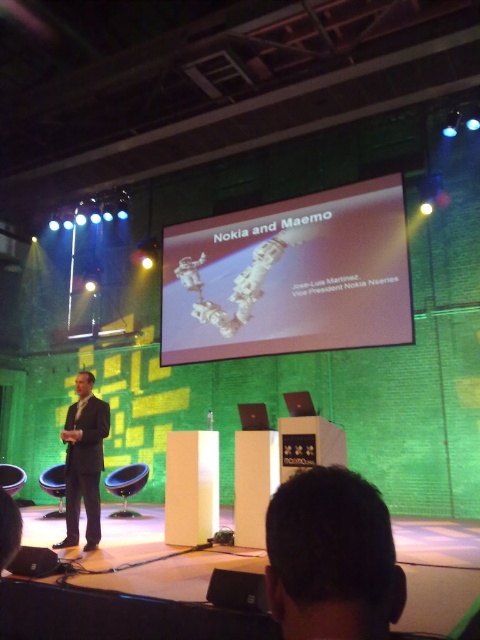
Question: Based on their relative distances, which object is nearer to the white glossy projector screen at upper center?

Choices:
 (A) dark suit at center
 (B) dark hair at upper center

Answer: (A)

Question: Is white glossy projector screen at upper center below dark hair at upper center?

Choices:
 (A) yes
 (B) no

Answer: (B)

Question: Which object is farther from the camera taking this photo?

Choices:
 (A) dark suit at center
 (B) white glossy projector screen at upper center

Answer: (B)

Question: Which point is farther from the camera taking this photo?

Choices:
 (A) (403, 579)
 (B) (272, 326)
 (C) (64, 545)

Answer: (B)

Question: Does dark hair at upper center appear on the right side of dark suit at center?

Choices:
 (A) no
 (B) yes

Answer: (B)

Question: Can you confirm if white glossy projector screen at upper center is positioned to the left of dark suit at center?

Choices:
 (A) yes
 (B) no

Answer: (B)